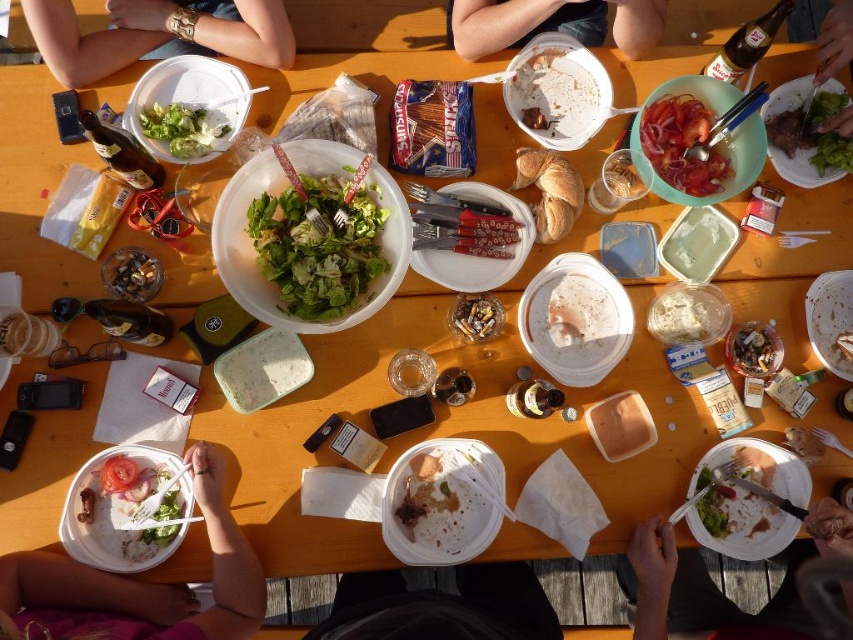
You are a guest at this picnic and see both the white crumbly cake at center and the white creamy substance at center on the table. Which of these two items is bigger in size?

The white crumbly cake at center is larger in size compared to the white creamy substance at center.

From the picture: You are a photographer trying to capture the white matte bread at center without the smooth skin arm at upper left blocking it. What adjustment should you make to your camera angle?

The smooth skin arm at upper left is closer to the viewer than the white matte bread at center. To avoid the arm blocking the bread, you should adjust your camera angle to look slightly downward or move the camera position to the side so that the arm is no longer in front of the bread.

You are setting up a small stand at the picnic to display snacks. You have a matte plastic container at center and a shiny metallic ashtray at center. Which item should you place closer to the edge of the table to prevent it from blocking the salad bowls in the middle?

The matte plastic container at center might be wider than the shiny metallic ashtray at center, so placing the wider matte plastic container at center closer to the edge would prevent it from obstructing the salad bowls in the middle.